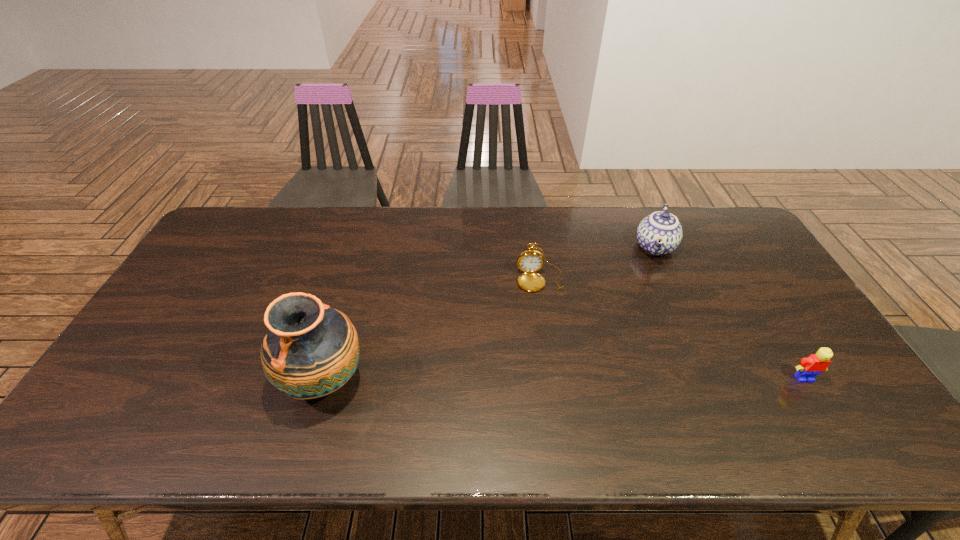
At what (x,y) coordinates should I click in order to perform the action: click on vacant point located between the Lego and the pottery. Please return your answer as a coordinate pair (x, y). The image size is (960, 540). Looking at the image, I should click on (564, 379).

The height and width of the screenshot is (540, 960). I want to click on vacant area that lies between the pocket watch and the chinaware, so click(597, 263).

You are a GUI agent. You are given a task and a screenshot of the screen. Output one action in this format:
    pyautogui.click(x=<x>, y=<y>)
    Task: Click on the free spot between the chinaware and the second object from left to right
    
    Given the screenshot: What is the action you would take?
    pyautogui.click(x=597, y=263)

Identify the location of object that is the second closest to the rightmost object. This screenshot has width=960, height=540. (530, 261).

Locate an element on the screen. The height and width of the screenshot is (540, 960). object that is the third closest to the pottery is located at coordinates (809, 368).

Where is `blank space that satisfies the following two spatial constraints: 1. on the back side of the third object from right to left; 2. on the left side of the third object from left to right`? The image size is (960, 540). blank space that satisfies the following two spatial constraints: 1. on the back side of the third object from right to left; 2. on the left side of the third object from left to right is located at coordinates (535, 246).

At what (x,y) coordinates should I click in order to perform the action: click on free region that satisfies the following two spatial constraints: 1. on the back side of the third object from left to right; 2. on the left side of the pocket watch. Please return your answer as a coordinate pair (x, y). This screenshot has width=960, height=540. Looking at the image, I should click on (535, 246).